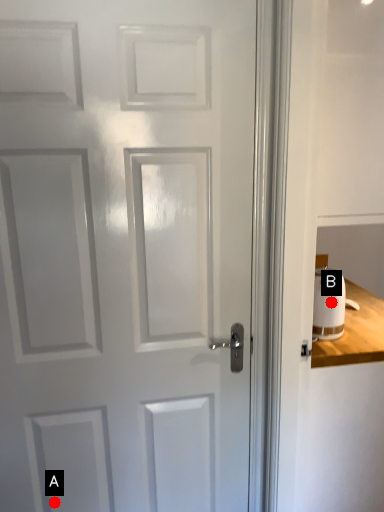
Question: Two points are circled on the image, labeled by A and B beside each circle. Which of the following is the farthest from the observer?

Choices:
 (A) A is further
 (B) B is further

Answer: (B)